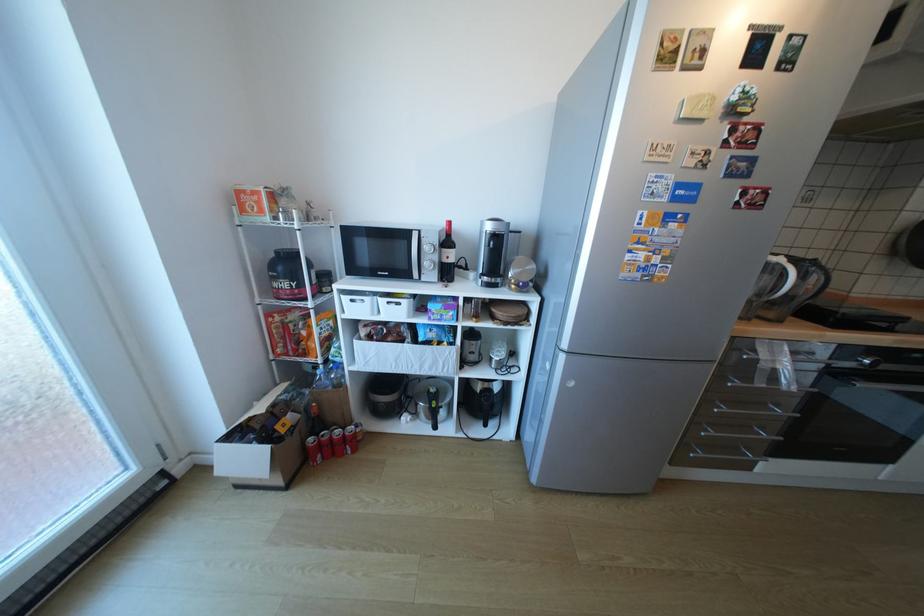
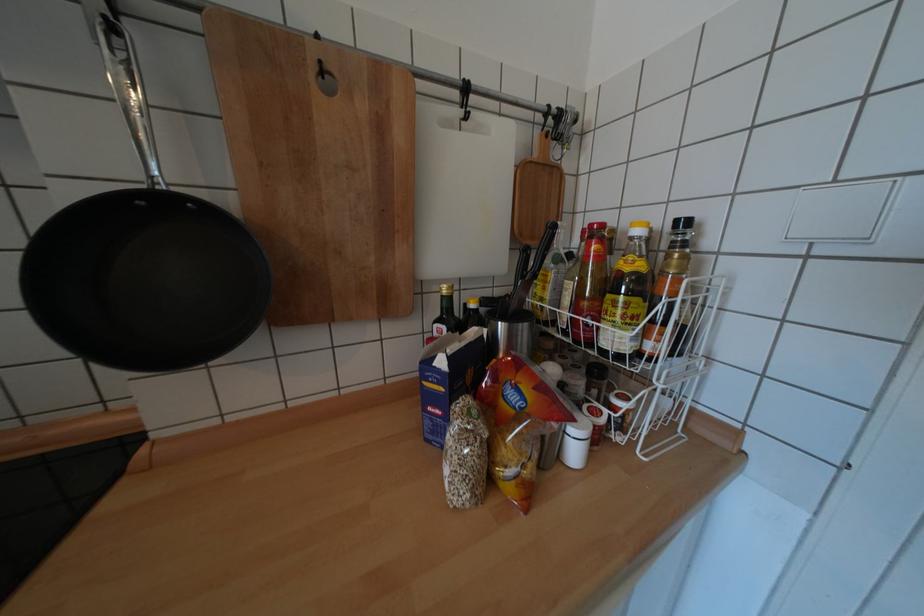
Question: Which direction would the cameraman need to move to produce the second image? Reply with the corresponding letter.

Choices:
 (A) Left
 (B) Right
 (C) Forward
 (D) Backward

Answer: (B)